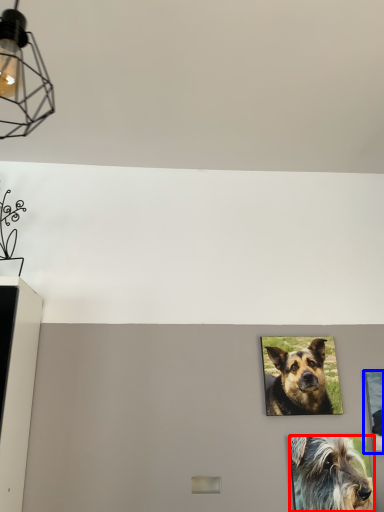
Question: Among these objects, which one is farthest to the camera, dog (highlighted by a red box) or picture frame (highlighted by a blue box)?

Choices:
 (A) dog
 (B) picture frame

Answer: (B)